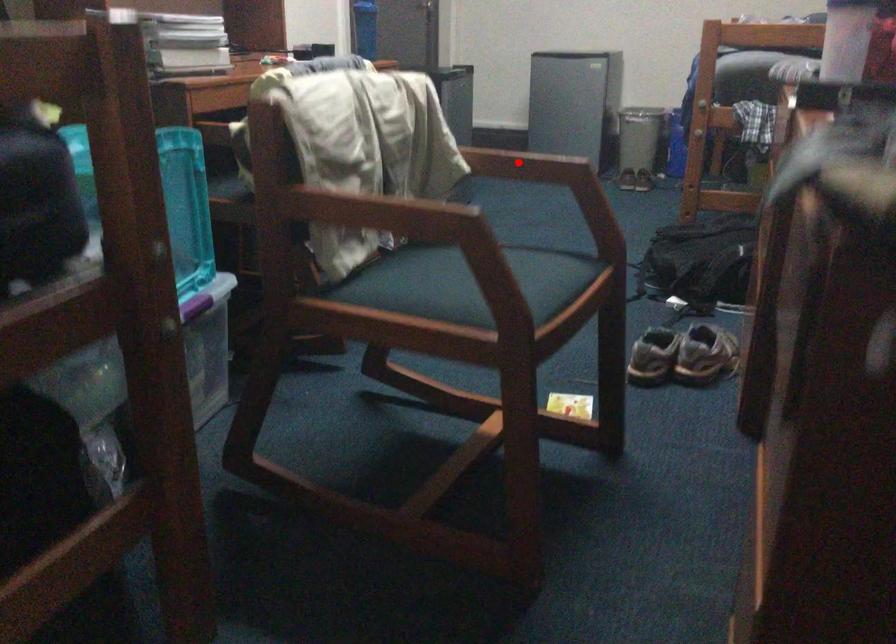
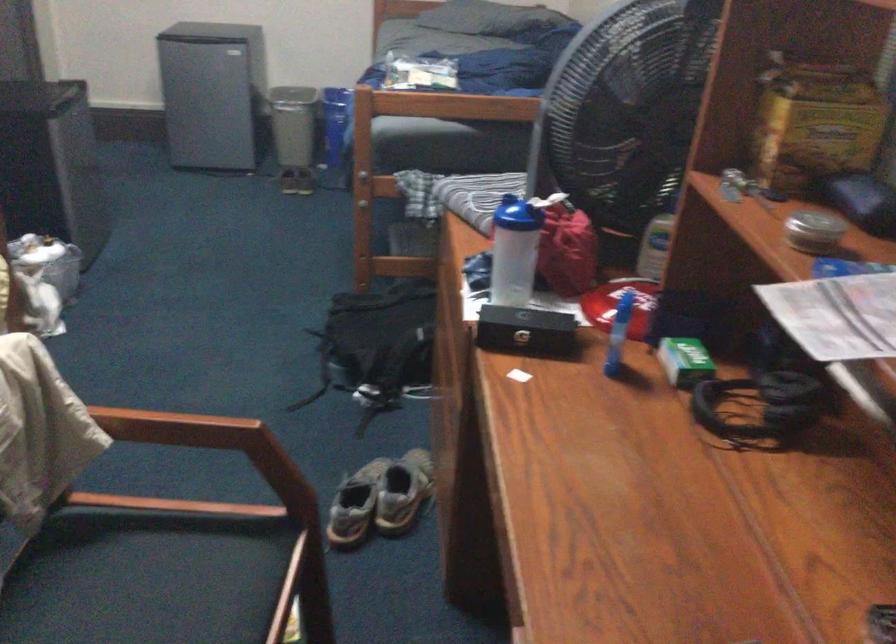
Question: I am providing you with two images of the same scene from different viewpoints. In image1, a red point is highlighted. Considering the same 3D point in image2, which of the following is correct?

Choices:
 (A) It is closer
 (B) It is farther

Answer: (A)